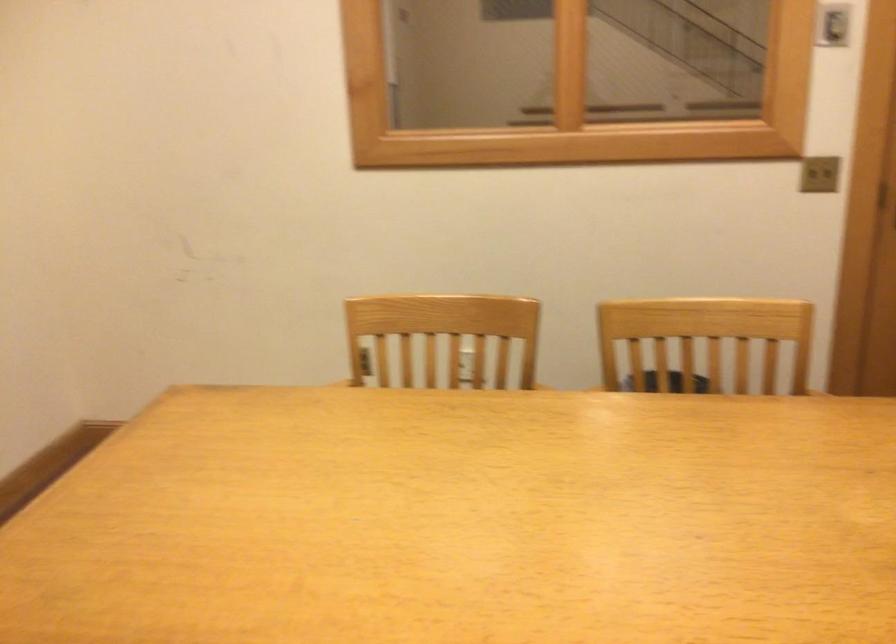
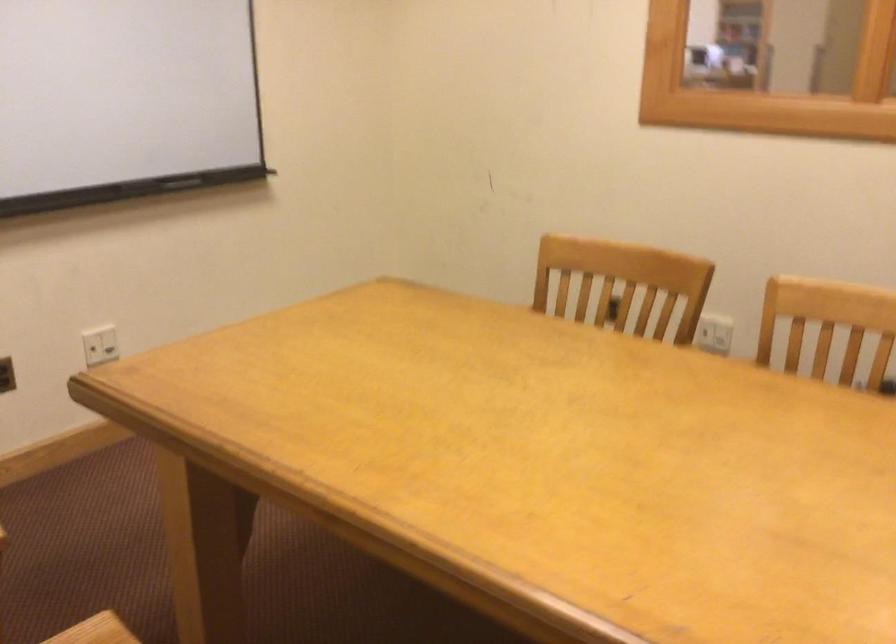
Question: The camera is either moving clockwise (left) or counter-clockwise (right) around the object. The first image is from the beginning of the video and the second image is from the end. Is the camera moving left or right when shooting the video?

Choices:
 (A) Left
 (B) Right

Answer: (B)